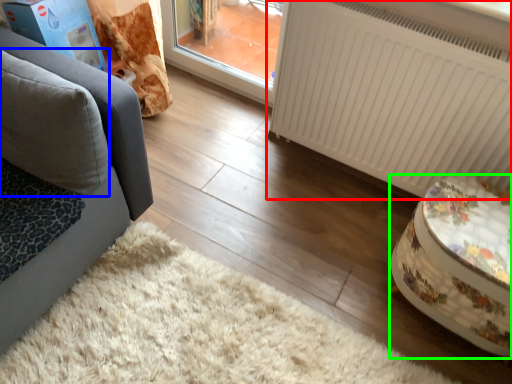
Question: Considering the real-world distances, which object is farthest from radiator (highlighted by a red box)? pillow (highlighted by a blue box) or furniture (highlighted by a green box)?

Choices:
 (A) pillow
 (B) furniture

Answer: (A)